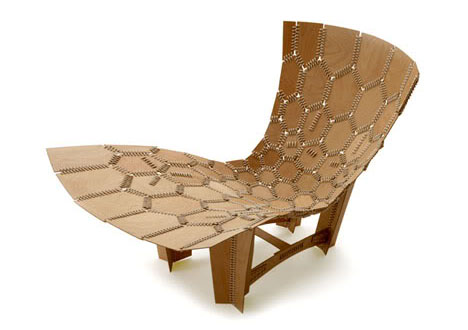
In order to click on part connecting chair legs in this screenshot , I will do `click(292, 250)`, `click(272, 241)`.